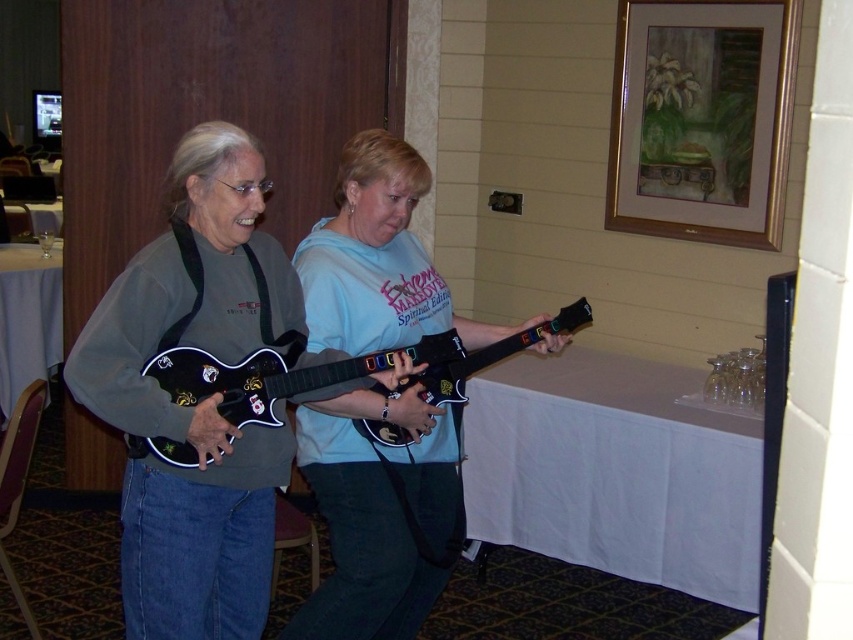
You are a game developer designing a new level where players must navigate between two guitar controllers. The light blue fabric guitar at center and the black glossy electric guitar at center are placed in the center of the room. Which guitar is located to the right of the other?

The light blue fabric guitar at center is positioned on the right side of black glossy electric guitar at center.

You are a delivery person who needs to place a small package on the floor between the matte black guitar at center and the viewer. The package requires a minimum of 1.5 meters of space to be placed safely. Can you safely place the package there?

The distance between the matte black guitar at center and the viewer is 1.69 meters, which is more than the required 1.5 meters. Therefore, the package can be safely placed there.